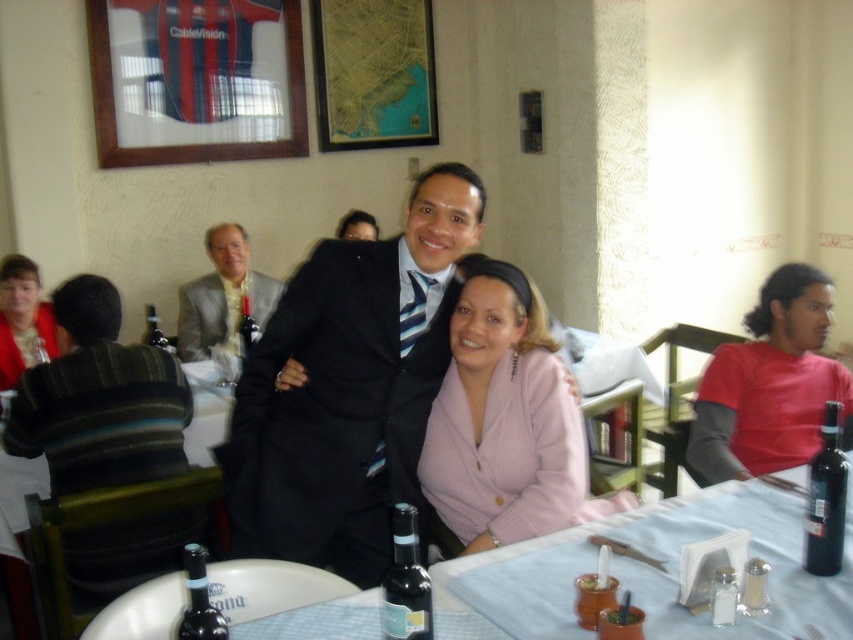
You are standing at the origin point in the image and want to locate the red cotton shirt at right. In terms of 2D coordinates, where would you find it?

The red cotton shirt at right is located at the 2D coordinates of point (x=770, y=384).

You are a photographer standing at the back of the restaurant. You need to take a photo of the matte black suit at center and the black glass bottle at lower right. However, you want to ensure that the bottle doesn not block the view of the suit in the photo. Based on their sizes, is this possible?

The matte black suit at center is taller than the black glass bottle at lower right, so as long as the bottle is placed behind the suit in the photo, it won not block the view of the suit.